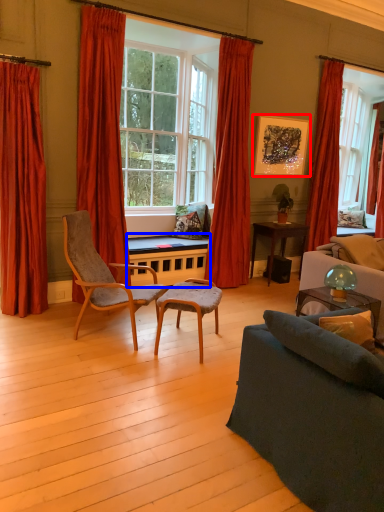
Question: Among these objects, which one is farthest to the camera, picture frame (highlighted by a red box) or table (highlighted by a blue box)?

Choices:
 (A) picture frame
 (B) table

Answer: (A)